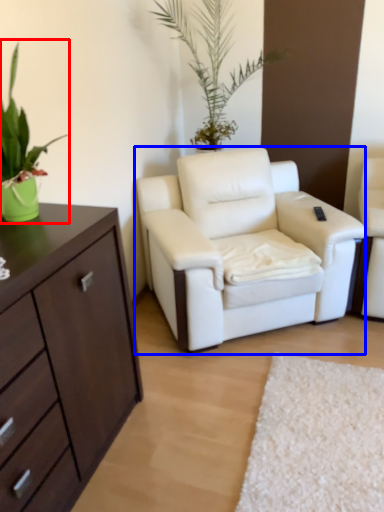
Question: Which point is further to the camera, houseplant (highlighted by a red box) or chair (highlighted by a blue box)?

Choices:
 (A) houseplant
 (B) chair

Answer: (B)